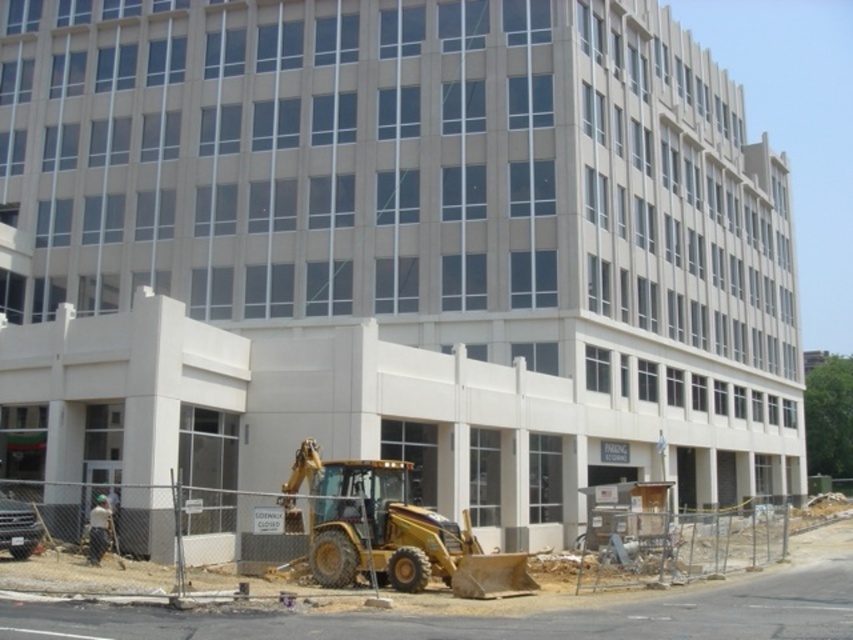
You are a pedestrian trying to cross the street near the construction site. There is a yellow metallic excavator at lower center and a white fabric construction worker at lower left. If you need to walk from the excavator to the worker, can you safely walk the 7.54 meters without stepping into the fenced area?

The distance between the yellow metallic excavator at lower center and the white fabric construction worker at lower left is 7.54 meters. However, the fenced area is between them, so you cannot safely walk that distance without entering restricted areas.

You are a pedestrian trying to walk from the sidewalk to the entrance of the building. The sidewalk is closed, but you see the yellow metallic backhoe at lower center and the white fabric construction worker at lower left. Can you safely walk around the fenced area to reach the entrance?

The yellow metallic backhoe at lower center is positioned under the white fabric construction worker at lower left, which means the backhoe is directly below the worker. This setup suggests that the area around the fenced zone might be restricted or unsafe for pedestrians. It is advisable to avoid walking around the fenced area and seek an alternative route to the entrance.